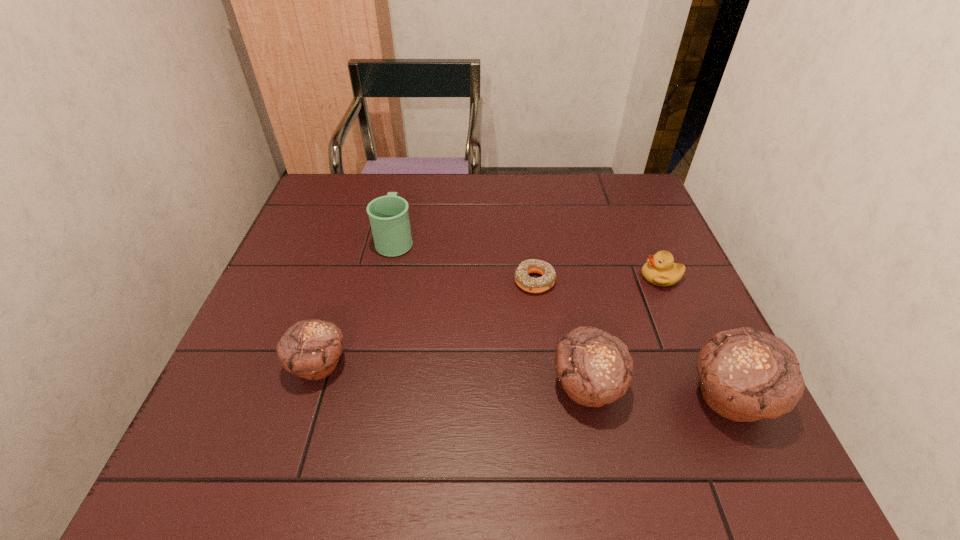
Where is `vacant space situated on the side of the farthest object with the handle`? vacant space situated on the side of the farthest object with the handle is located at coordinates (409, 179).

Where is `free spot located on the side of the farthest object with the handle`? free spot located on the side of the farthest object with the handle is located at coordinates (403, 203).

At what (x,y) coordinates should I click in order to perform the action: click on vacant space situated on the side of the farthest object with the handle. Please return your answer as a coordinate pair (x, y). The width and height of the screenshot is (960, 540). Looking at the image, I should click on (404, 198).

Locate an element on the screen. vacant position located on the back of the doughnut is located at coordinates (524, 203).

Locate an element on the screen. This screenshot has height=540, width=960. free space located 0.140m on the front-facing side of the second shortest object is located at coordinates (586, 277).

You are a GUI agent. You are given a task and a screenshot of the screen. Output one action in this format:
    pyautogui.click(x=<x>, y=<y>)
    Task: Click on the free space located on the front-facing side of the second shortest object
    
    Given the screenshot: What is the action you would take?
    pyautogui.click(x=518, y=277)

The width and height of the screenshot is (960, 540). I want to click on vacant space located on the front-facing side of the second shortest object, so click(x=565, y=277).

In order to click on object present at the left edge in this screenshot , I will do [311, 349].

You are a GUI agent. You are given a task and a screenshot of the screen. Output one action in this format:
    pyautogui.click(x=<x>, y=<y>)
    Task: Click on the muffin located at the right edge
    This screenshot has height=540, width=960.
    Given the screenshot: What is the action you would take?
    pyautogui.click(x=745, y=374)

Where is `duckling that is at the right edge`? The image size is (960, 540). duckling that is at the right edge is located at coordinates (660, 269).